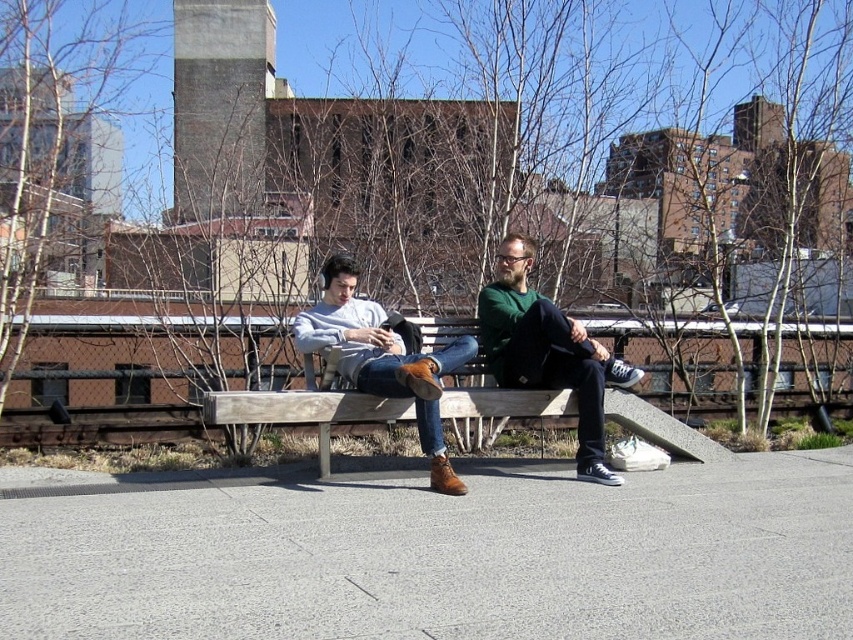
You are taking a photo of the two people on the wooden bench in the urban park. You want to focus on the person closer to the camera. Which of the two points, point 1 at coordinates (561, 360) or point 2 at coordinates (520, 244), should you aim your camera at to ensure the person is in focus?

You should aim your camera at point 1 at coordinates (561, 360) because it is closer to the camera than point 2 at coordinates (520, 244), making it the better focus point for the person closer to you.

You are a photographer trying to capture a clear shot of the matte brown leather shoes at center and the green sweater at center. Since you want to focus on both objects, which one should you adjust your camera lens to prioritize focusing on first, considering their positions?

The matte brown leather shoes at center should be prioritized for focusing first because they are positioned above the green sweater at center, making them closer to the camera lens.

You are designing a custom bench cover that needs to fit snugly around the existing bench. The cover must accommodate both the matte brown leather shoes at center and the green sweater at center. Based on their widths, which object requires more horizontal space in the bench cover design?

The matte brown leather shoes at center require more horizontal space in the bench cover design since their width surpasses that of the green sweater at center.